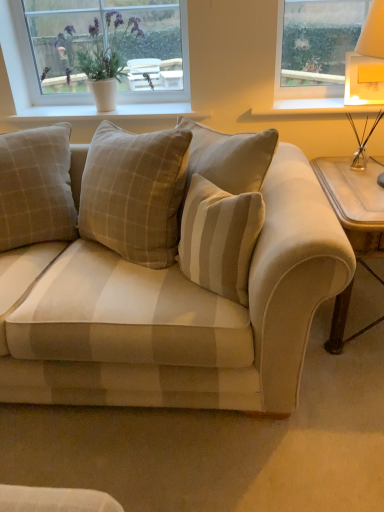
Question: Does beige fabric couch at center come in front of beige plaid pillow at center?

Choices:
 (A) no
 (B) yes

Answer: (B)

Question: Is beige fabric couch at center not inside beige plaid pillow at center?

Choices:
 (A) no
 (B) yes

Answer: (B)

Question: Is the surface of beige fabric couch at center in direct contact with beige plaid pillow at center?

Choices:
 (A) no
 (B) yes

Answer: (A)

Question: Does beige fabric couch at center have a larger size compared to beige plaid pillow at center?

Choices:
 (A) no
 (B) yes

Answer: (B)

Question: From a real-world perspective, is beige fabric couch at center below beige plaid pillow at center?

Choices:
 (A) no
 (B) yes

Answer: (B)

Question: From a real-world perspective, is beige fabric couch at center positioned over beige plaid pillow at center based on gravity?

Choices:
 (A) yes
 (B) no

Answer: (B)

Question: Is beige fabric couch at center positioned in front of white painted wood at upper right?

Choices:
 (A) yes
 (B) no

Answer: (A)

Question: Does beige fabric couch at center have a greater width compared to white painted wood at upper right?

Choices:
 (A) no
 (B) yes

Answer: (B)

Question: Is white painted wood at upper right located within beige fabric couch at center?

Choices:
 (A) yes
 (B) no

Answer: (B)

Question: Would you say beige fabric couch at center is a long distance from white painted wood at upper right?

Choices:
 (A) yes
 (B) no

Answer: (B)

Question: Considering the relative positions of beige fabric couch at center and white painted wood at upper right in the image provided, is beige fabric couch at center behind white painted wood at upper right?

Choices:
 (A) no
 (B) yes

Answer: (A)

Question: Is beige fabric couch at center facing towards white painted wood at upper right?

Choices:
 (A) yes
 (B) no

Answer: (B)

Question: Would you say beige plaid pillow at center contains beige fabric couch at center?

Choices:
 (A) yes
 (B) no

Answer: (B)